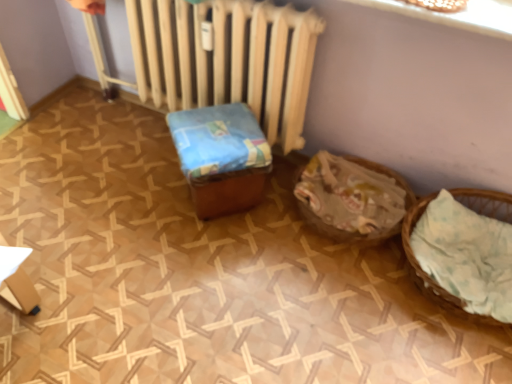
Locate an element on the screen. vacant region above blue fabric-covered box at center (from a real-world perspective) is located at coordinates (217, 130).